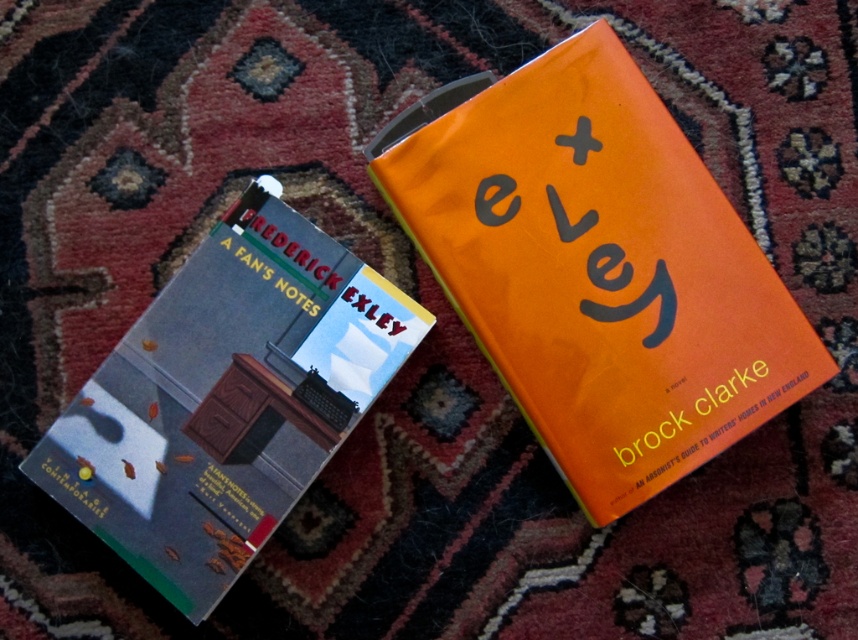
Does orange matte book at upper right come in front of hardcover book at left?

That is False.

Which is behind, point (560, 125) or point (267, 308)?

The point (560, 125) is more distant.

Does point (515, 156) lie in front of point (369, 292)?

Yes, it is.

Locate an element on the screen. This screenshot has width=858, height=640. orange matte book at upper right is located at coordinates (601, 272).